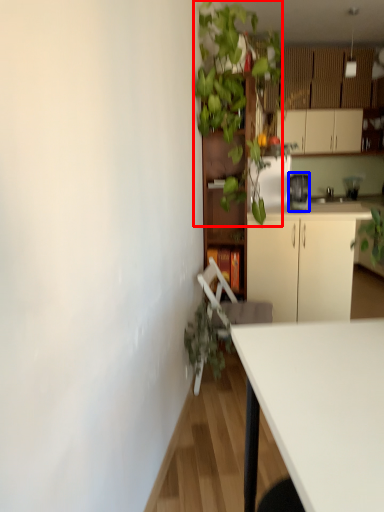
Question: Among these objects, which one is nearest to the camera, vegetation (highlighted by a red box) or appliance (highlighted by a blue box)?

Choices:
 (A) vegetation
 (B) appliance

Answer: (A)